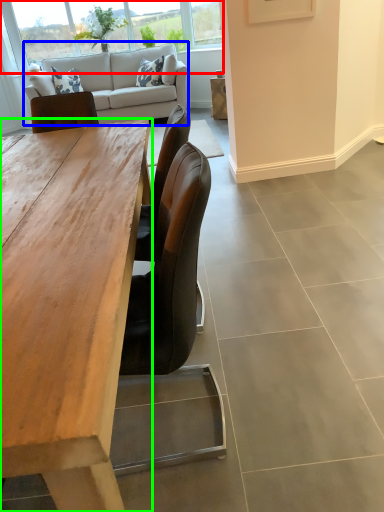
Question: Based on their relative distances, which object is nearer to window (highlighted by a red box)? Choose from studio couch (highlighted by a blue box) and desk (highlighted by a green box).

Choices:
 (A) studio couch
 (B) desk

Answer: (A)